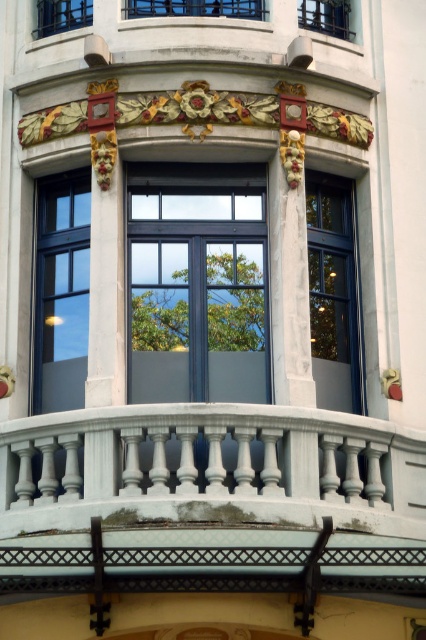
Is point (298, 486) behind point (43, 13)?

No, (298, 486) is closer to viewer.

Is white stone balustrade at center closer to the viewer compared to matte black window at upper left?

Yes, it is.

Which is behind, point (371, 577) or point (80, 24)?

The point (80, 24) is more distant.

Image resolution: width=426 pixels, height=640 pixels. In order to click on white stone balustrade at center in this screenshot , I will do `click(210, 499)`.

Who is more distant from viewer, (264,472) or (316,3)?

The point (316,3) is more distant.

Can you confirm if white stone balustrade at center is positioned below clear glass window at upper center?

Indeed, white stone balustrade at center is positioned under clear glass window at upper center.

Describe the element at coordinates (210, 499) in the screenshot. I see `white stone balustrade at center` at that location.

Find the location of `white stone balustrade at center`. white stone balustrade at center is located at coordinates (210, 499).

Is clear glass window at upper center below matte black window at upper left?

No, clear glass window at upper center is not below matte black window at upper left.

Where is `clear glass window at upper center`? The width and height of the screenshot is (426, 640). clear glass window at upper center is located at coordinates (325, 17).